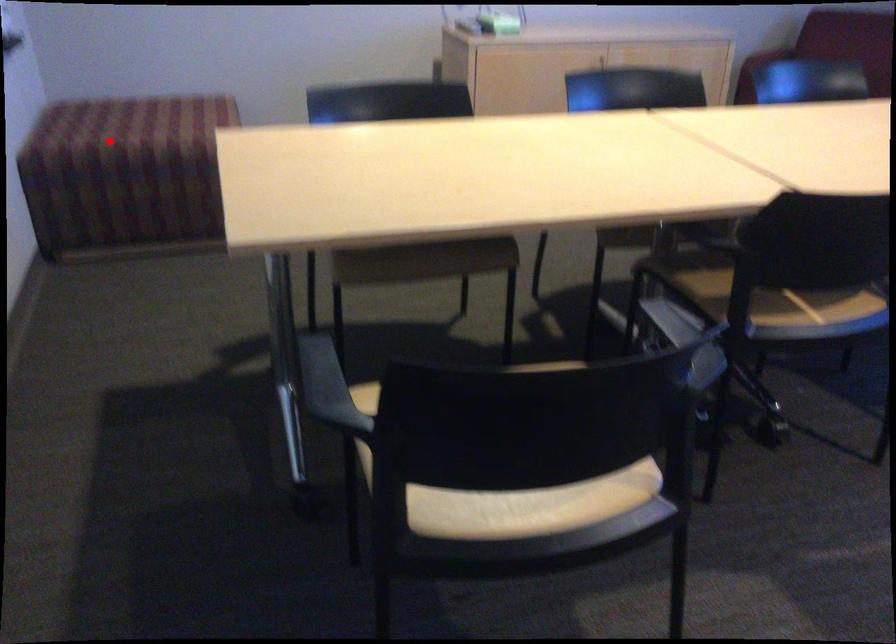
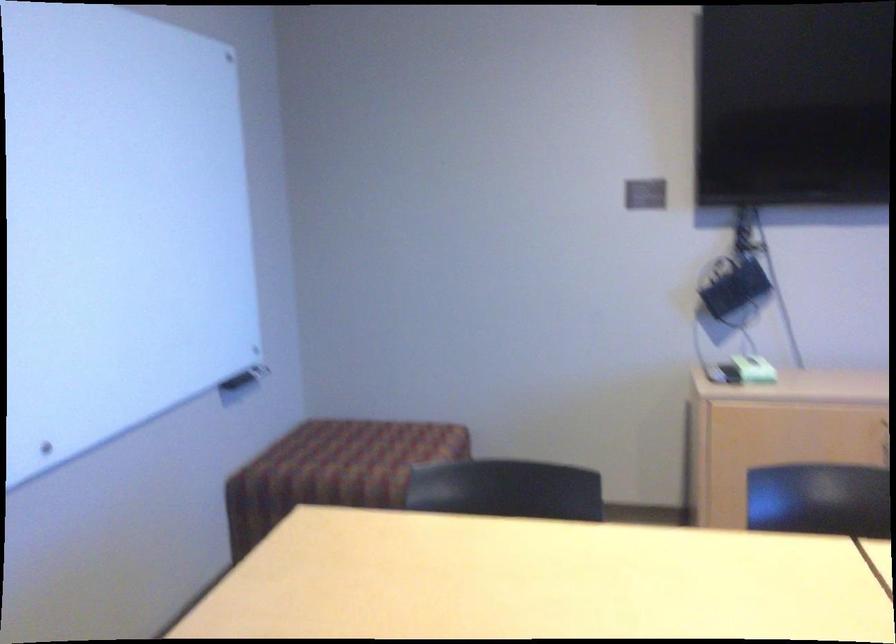
In the second image, find the point that corresponds to the highlighted location in the first image.

(331, 465)